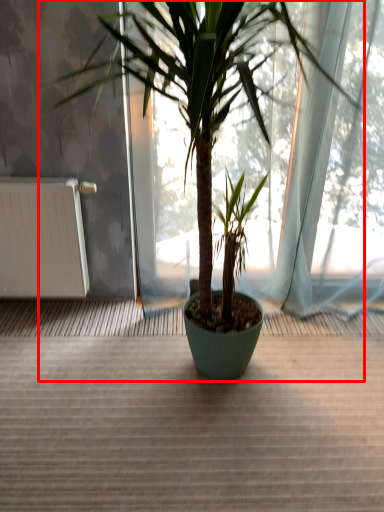
Question: From the image's perspective, considering the relative positions of houseplant (annotated by the red box) and radiator in the image provided, where is houseplant (annotated by the red box) located with respect to the staircase?

Choices:
 (A) below
 (B) above

Answer: (B)